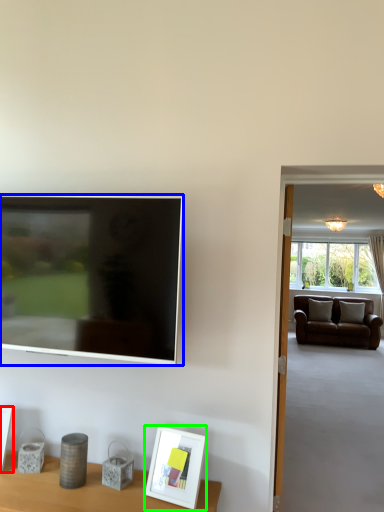
Question: Based on their relative distances, which object is farther from picture frame (highlighted by a red box)? Choose from television (highlighted by a blue box) and picture frame (highlighted by a green box).

Choices:
 (A) television
 (B) picture frame

Answer: (B)